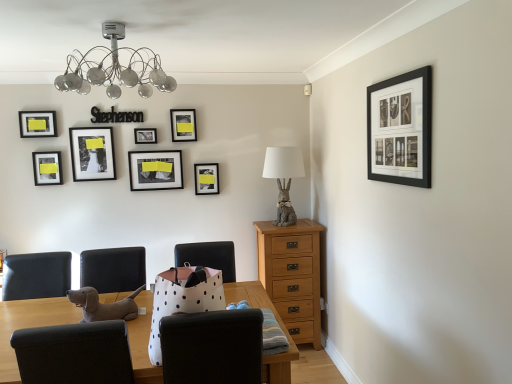
Question: Does black matte picture frame at upper right, the first picture frame from the right, appear on the right side of matte gray rabbit at center right?

Choices:
 (A) yes
 (B) no

Answer: (A)

Question: Is black matte picture frame at upper right, acting as the 1th picture frame starting from the front, far from matte gray rabbit at center right?

Choices:
 (A) no
 (B) yes

Answer: (B)

Question: From the image's perspective, does black matte picture frame at upper right, which is counted as the 8th picture frame, starting from the left, appear lower than matte gray rabbit at center right?

Choices:
 (A) yes
 (B) no

Answer: (B)

Question: Can you confirm if black matte picture frame at upper right, which is the 8th picture frame from back to front, is bigger than matte gray rabbit at center right?

Choices:
 (A) no
 (B) yes

Answer: (A)

Question: Is black matte picture frame at upper right, acting as the 1th picture frame starting from the front, at the left side of matte gray rabbit at center right?

Choices:
 (A) yes
 (B) no

Answer: (B)

Question: Is black matte picture frame at upper right, which is the 8th picture frame from back to front, touching matte gray rabbit at center right?

Choices:
 (A) yes
 (B) no

Answer: (B)

Question: Considering the relative positions of matte black picture frame at upper center, arranged as the sixth picture frame when viewed from the front, and matte black picture frame at left, marked as the 3th picture frame in a front-to-back arrangement, in the image provided, is matte black picture frame at upper center, arranged as the sixth picture frame when viewed from the front, to the right of matte black picture frame at left, marked as the 3th picture frame in a front-to-back arrangement, from the viewer's perspective?

Choices:
 (A) no
 (B) yes

Answer: (B)

Question: Considering the relative positions of matte black picture frame at upper center, which appears as the 4th picture frame when viewed from the right, and matte black picture frame at left, marked as the 3th picture frame in a front-to-back arrangement, in the image provided, is matte black picture frame at upper center, which appears as the 4th picture frame when viewed from the right, to the left of matte black picture frame at left, marked as the 3th picture frame in a front-to-back arrangement, from the viewer's perspective?

Choices:
 (A) yes
 (B) no

Answer: (B)

Question: Is matte black picture frame at upper center, the fifth picture frame from the left, surrounding matte black picture frame at left, marked as the second picture frame in a left-to-right arrangement?

Choices:
 (A) yes
 (B) no

Answer: (B)

Question: From a real-world perspective, is matte black picture frame at upper center, which appears as the 4th picture frame when viewed from the right, on top of matte black picture frame at left, the 6th picture frame when ordered from back to front?

Choices:
 (A) no
 (B) yes

Answer: (A)

Question: Is matte black picture frame at upper center, the fifth picture frame from the left, closer to camera compared to matte black picture frame at left, the 6th picture frame when ordered from back to front?

Choices:
 (A) no
 (B) yes

Answer: (A)

Question: From a real-world perspective, does matte black picture frame at upper center, arranged as the sixth picture frame when viewed from the front, sit lower than matte black picture frame at left, marked as the 3th picture frame in a front-to-back arrangement?

Choices:
 (A) yes
 (B) no

Answer: (A)

Question: Is matte black picture frame at upper center, the fifth picture frame from the left, oriented away from white polka dot paper bag at center, positioned as the 2th chair in left-to-right order?

Choices:
 (A) no
 (B) yes

Answer: (A)